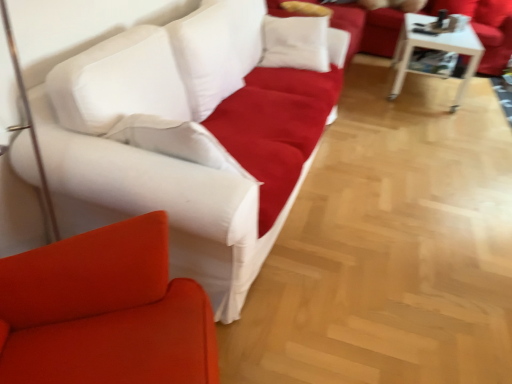
Question: Would you say white glossy table at upper right is inside or outside matte white studio couch at upper center, which is the 2th studio couch in bottom-to-top order?

Choices:
 (A) inside
 (B) outside

Answer: (B)

Question: Considering the positions of white glossy table at upper right and matte white studio couch at upper center, which is the 2th studio couch in bottom-to-top order, in the image, is white glossy table at upper right bigger or smaller than matte white studio couch at upper center, which is the 2th studio couch in bottom-to-top order,?

Choices:
 (A) big
 (B) small

Answer: (B)

Question: Estimate the real-world distances between objects in this image. Which object is farther from the white glossy table at upper right?

Choices:
 (A) white fabric couch at center, the second studio couch in the top-to-bottom sequence
 (B) matte white studio couch at upper center, which is the 2th studio couch in bottom-to-top order

Answer: (A)

Question: Which of these objects is positioned farthest from the white fabric couch at center, which is counted as the 2th studio couch, starting from the back?

Choices:
 (A) white glossy table at upper right
 (B) matte white studio couch at upper center, which is the first studio couch from top to bottom

Answer: (B)